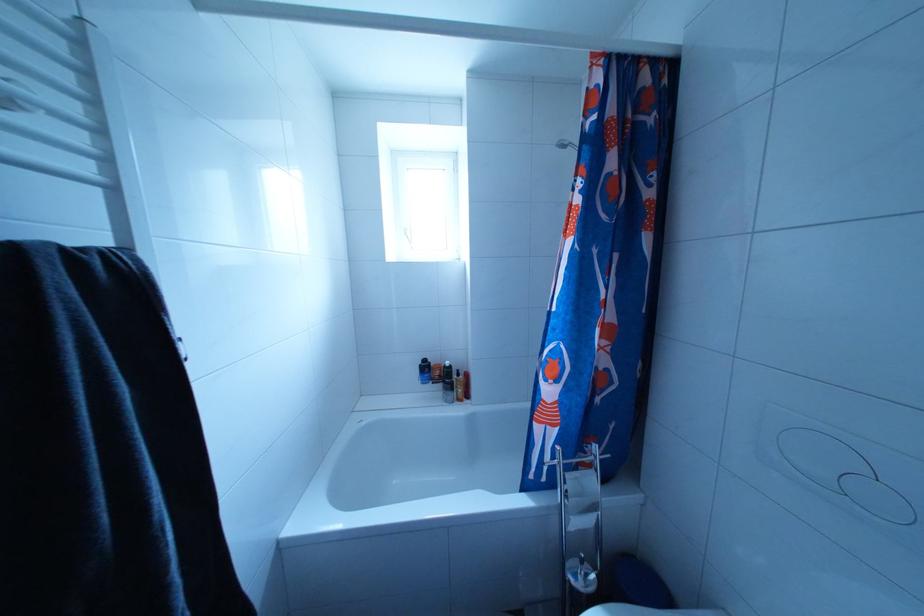
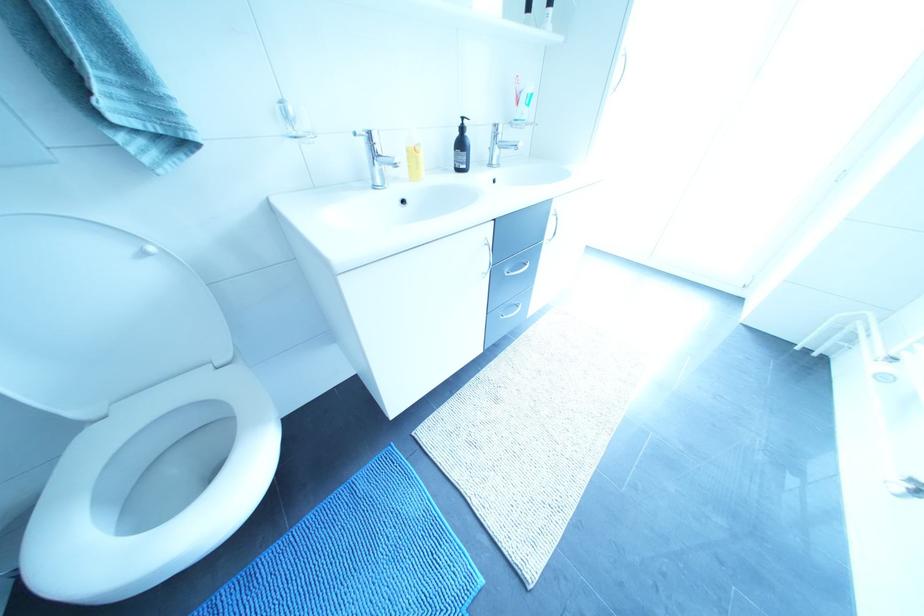
Question: I am providing you with two images of the same scene from different viewpoints. After the viewpoint changes to image2, which objects are now occluded?

Choices:
 (A) blue shower curtain
 (B) chrome faucet handle
 (C) white toilet seat
 (D) black trash can lid

Answer: (A)